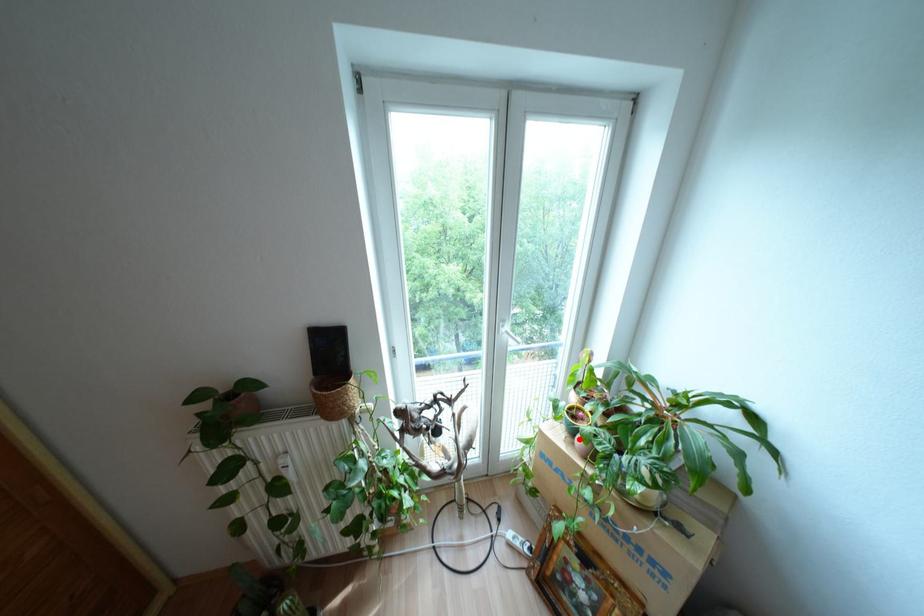
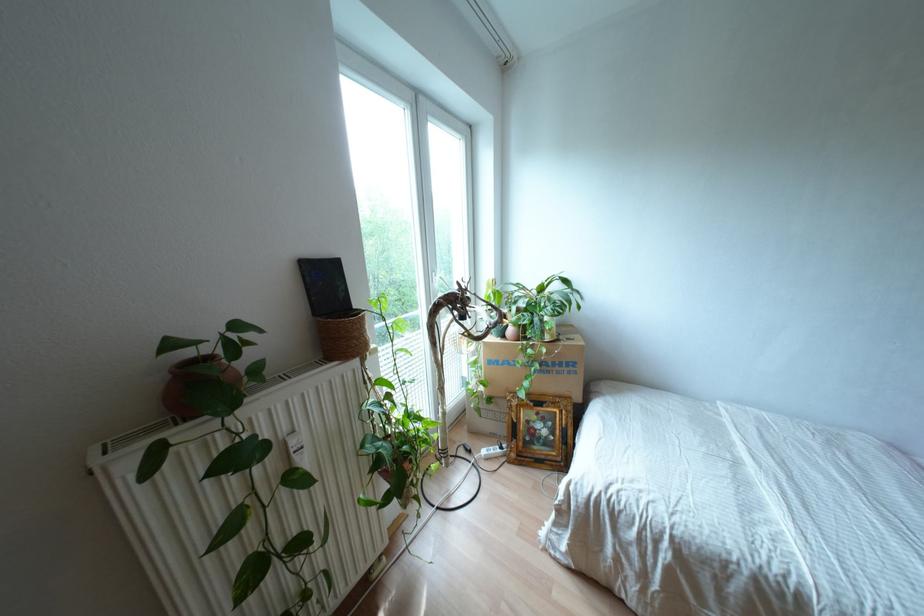
Question: I am providing you with two images of the same scene from different viewpoints. Given a red point in image1, look at the same physical point in image2. Is it:

Choices:
 (A) Closer to the viewpoint
 (B) Farther from the viewpoint

Answer: (B)